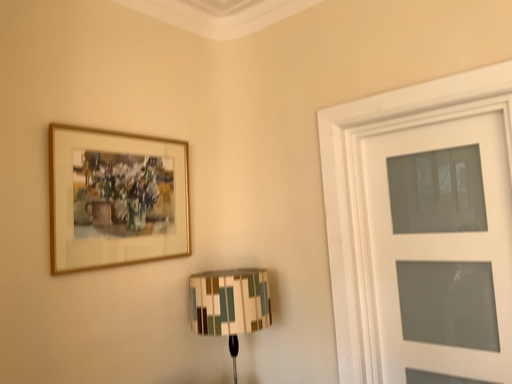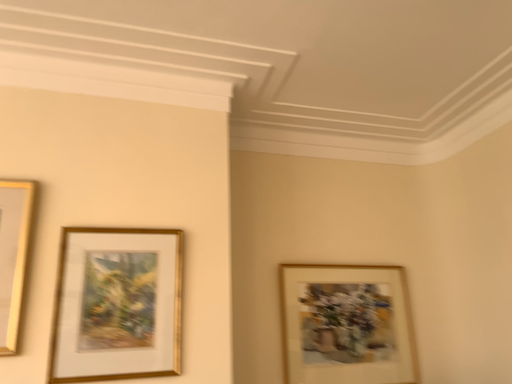
Question: Which way did the camera rotate in the video?

Choices:
 (A) rotated right
 (B) rotated left

Answer: (B)